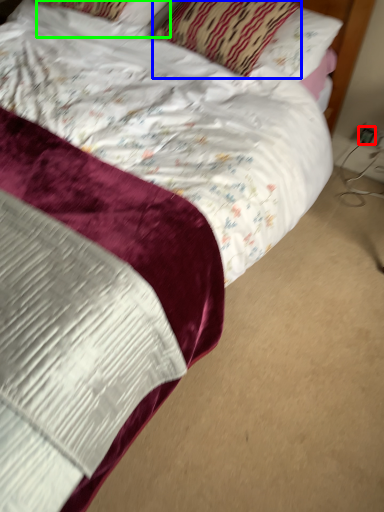
Question: Based on their relative distances, which object is farther from electric outlet (highlighted by a red box)? Choose from pillow (highlighted by a blue box) and pillow (highlighted by a green box).

Choices:
 (A) pillow
 (B) pillow

Answer: (B)